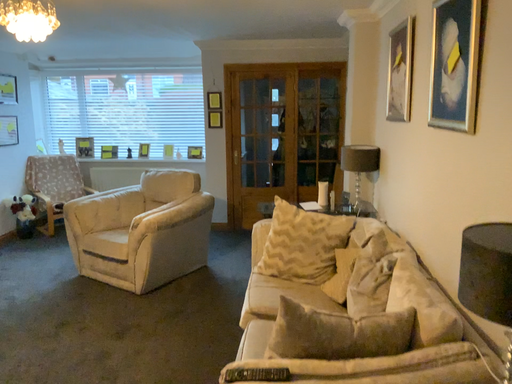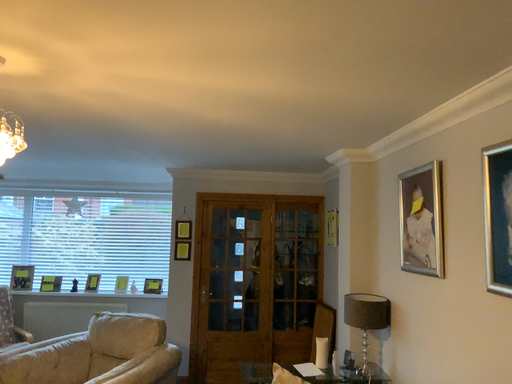
Question: How did the camera likely rotate when shooting the video?

Choices:
 (A) rotated left
 (B) rotated right

Answer: (B)